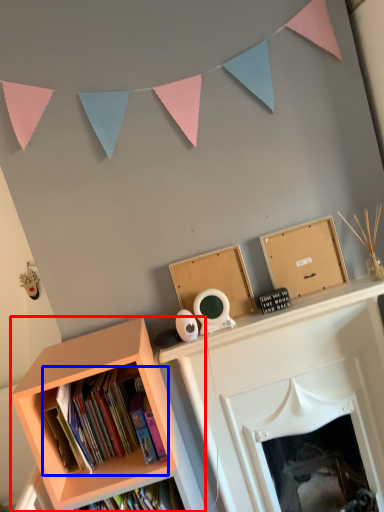
Question: Which point is closer to the camera, bookcase (highlighted by a red box) or book (highlighted by a blue box)?

Choices:
 (A) bookcase
 (B) book

Answer: (A)